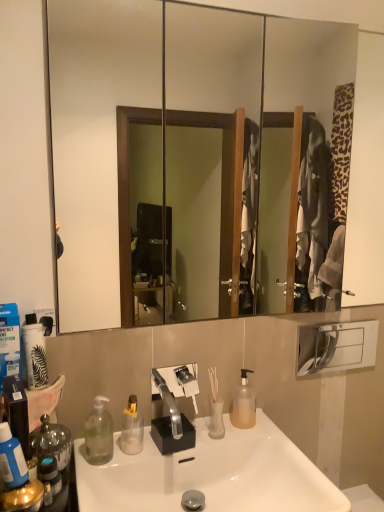
Identify the location of empty space that is to the right of clear glass vase at center. (254, 429).